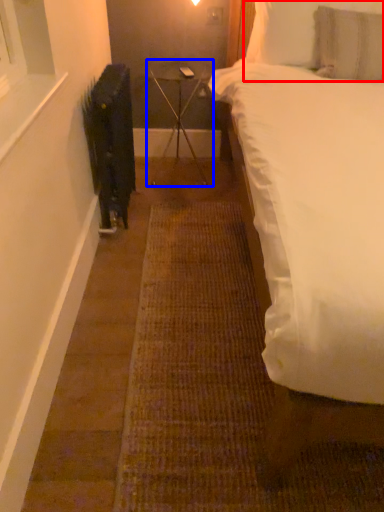
Question: Which of the following is the closest to the observer, pillow (highlighted by a red box) or table (highlighted by a blue box)?

Choices:
 (A) pillow
 (B) table

Answer: (A)